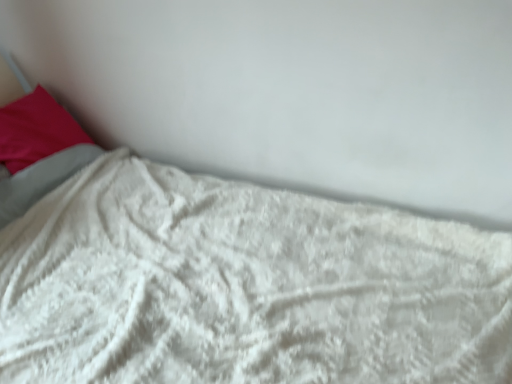
From the picture: In order to face matte red pillow at left, should I rotate leftwards or rightwards?

To face it directly, rotate left by 27.771 degrees.

The height and width of the screenshot is (384, 512). I want to click on matte red pillow at left, so click(36, 130).

Image resolution: width=512 pixels, height=384 pixels. Describe the element at coordinates (36, 130) in the screenshot. I see `matte red pillow at left` at that location.

Find the location of `matte red pillow at left`. matte red pillow at left is located at coordinates (36, 130).